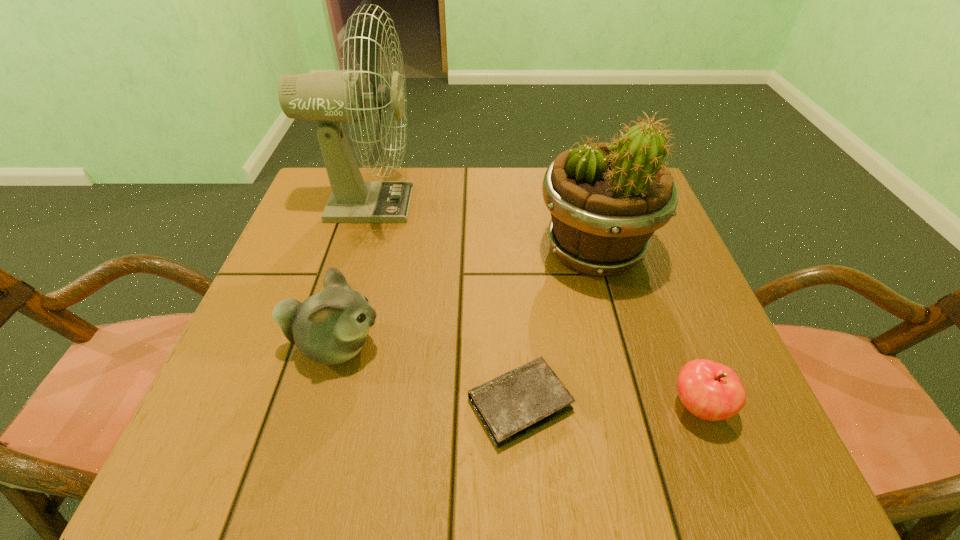
Locate an element on the screen. Image resolution: width=960 pixels, height=540 pixels. vacant space that satisfies the following two spatial constraints: 1. on the air flow direction of the second tallest object; 2. on the left side of the fan is located at coordinates (352, 252).

Where is `vacant space that satisfies the following two spatial constraints: 1. on the face of the hamster; 2. on the back side of the shortest object`? vacant space that satisfies the following two spatial constraints: 1. on the face of the hamster; 2. on the back side of the shortest object is located at coordinates [x=320, y=403].

Find the location of a particular element. The width and height of the screenshot is (960, 540). vacant space that satisfies the following two spatial constraints: 1. on the face of the third tallest object; 2. on the right side of the diary is located at coordinates (320, 403).

In order to click on vacant space that satisfies the following two spatial constraints: 1. on the back side of the apple; 2. on the air flow direction of the tallest object in this screenshot , I will do `click(621, 205)`.

Image resolution: width=960 pixels, height=540 pixels. I want to click on free space in the image that satisfies the following two spatial constraints: 1. on the face of the apple; 2. on the right side of the hamster, so click(319, 407).

Identify the location of vacant space that satisfies the following two spatial constraints: 1. on the air flow direction of the tallest object; 2. on the back side of the apple. (304, 407).

Locate an element on the screen. This screenshot has width=960, height=540. vacant region that satisfies the following two spatial constraints: 1. on the air flow direction of the flowerpot; 2. on the left side of the fan is located at coordinates (352, 252).

The height and width of the screenshot is (540, 960). Find the location of `vacant space that satisfies the following two spatial constraints: 1. on the air flow direction of the second shortest object; 2. on the right side of the tallest object`. vacant space that satisfies the following two spatial constraints: 1. on the air flow direction of the second shortest object; 2. on the right side of the tallest object is located at coordinates (304, 407).

Image resolution: width=960 pixels, height=540 pixels. Identify the location of vacant region that satisfies the following two spatial constraints: 1. on the face of the third tallest object; 2. on the back side of the apple. (319, 407).